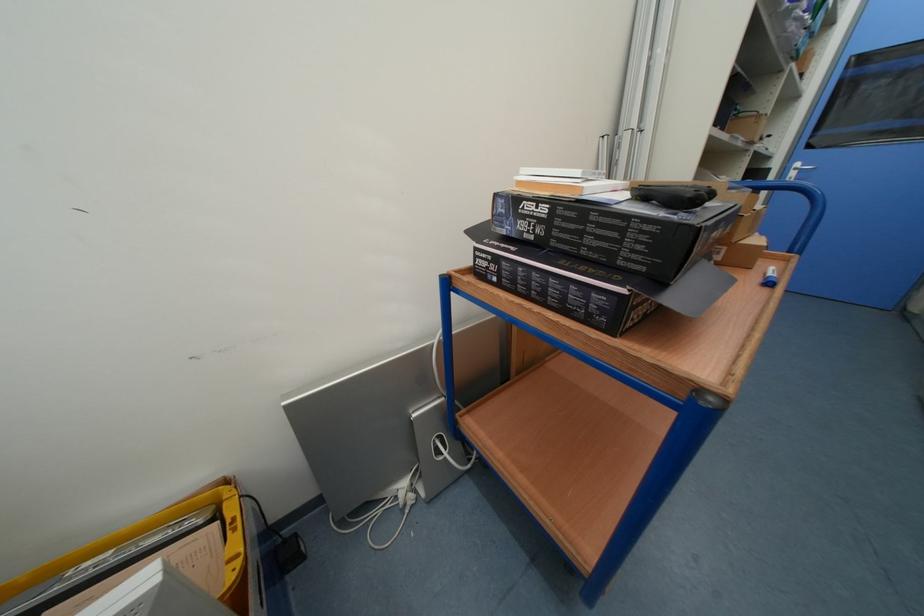
The image size is (924, 616). Find the location of `silver door handle`. silver door handle is located at coordinates (797, 169).